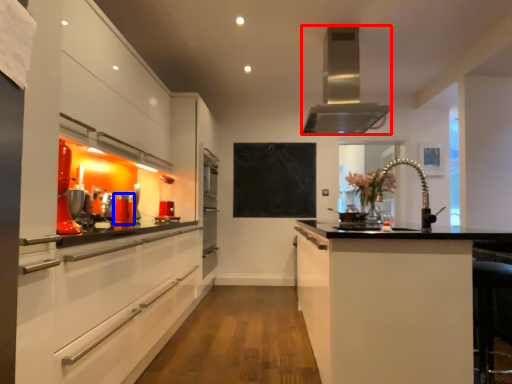
Question: Which of the following is the closest to the observer, home appliance (highlighted by a red box) or appliance (highlighted by a blue box)?

Choices:
 (A) home appliance
 (B) appliance

Answer: (B)